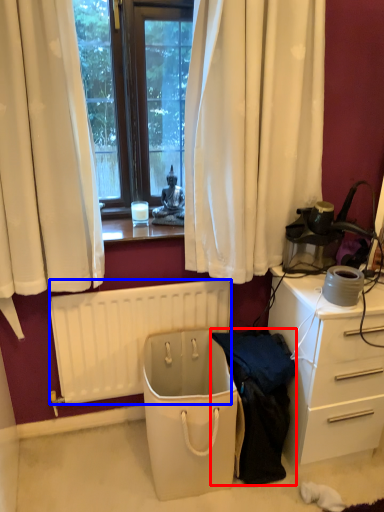
Question: Among these objects, which one is farthest to the camera, clothing (highlighted by a red box) or radiator (highlighted by a blue box)?

Choices:
 (A) clothing
 (B) radiator

Answer: (B)